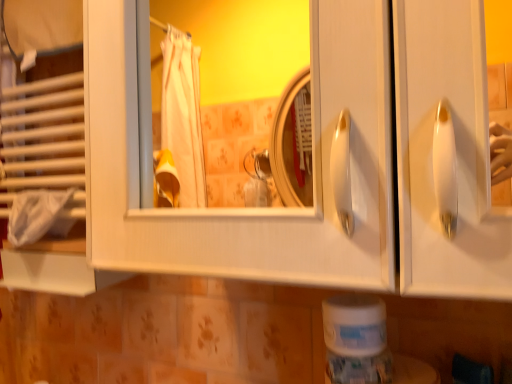
The image size is (512, 384). In order to click on white fabric bath towel at left in this screenshot , I will do `click(38, 216)`.

This screenshot has height=384, width=512. What do you see at coordinates (38, 216) in the screenshot?
I see `white fabric bath towel at left` at bounding box center [38, 216].

What do you see at coordinates (354, 325) in the screenshot?
I see `white matte toilet paper at lower center` at bounding box center [354, 325].

I want to click on white matte toilet paper at lower center, so click(x=354, y=325).

In order to face white matte toilet paper at lower center, should I rotate leftwards or rightwards?

It's best to rotate right around 12.979 degrees.

Locate an element on the screen. The image size is (512, 384). white fabric bath towel at left is located at coordinates (38, 216).

Does white matte toilet paper at lower center appear on the left side of white fabric bath towel at left?

Incorrect, white matte toilet paper at lower center is not on the left side of white fabric bath towel at left.

Is white matte toilet paper at lower center in front of or behind white fabric bath towel at left in the image?

A: Visually, white matte toilet paper at lower center is located in front of white fabric bath towel at left.

Is point (343, 313) behind point (29, 228)?

No.

From the image's perspective, between white matte toilet paper at lower center and white fabric bath towel at left, who is located below?

white matte toilet paper at lower center, from the image's perspective.

From a real-world perspective, is white matte toilet paper at lower center under white fabric bath towel at left?

Yes, from a real-world perspective, white matte toilet paper at lower center is under white fabric bath towel at left.

Does white matte toilet paper at lower center have a lesser width compared to white fabric bath towel at left?

No.

Does white matte toilet paper at lower center have a lesser height compared to white fabric bath towel at left?

Yes, white matte toilet paper at lower center is shorter than white fabric bath towel at left.

Between white matte toilet paper at lower center and white fabric bath towel at left, which one has larger size?

white fabric bath towel at left is bigger.

Would you say white matte toilet paper at lower center is inside or outside white fabric bath towel at left?

white matte toilet paper at lower center is not inside white fabric bath towel at left, it's outside.

Is there a large distance between white matte toilet paper at lower center and white fabric bath towel at left?

No, white matte toilet paper at lower center is not far from white fabric bath towel at left.

In the scene shown: Is white matte toilet paper at lower center turned away from white fabric bath towel at left?

white matte toilet paper at lower center is not turned away from white fabric bath towel at left.

What's the angular difference between white matte toilet paper at lower center and white fabric bath towel at left's facing directions?

The angular difference between white matte toilet paper at lower center and white fabric bath towel at left is 0.786 degrees.

Looking at this image, measure the distance from white matte toilet paper at lower center to white fabric bath towel at left.

The distance of white matte toilet paper at lower center from white fabric bath towel at left is 24.91 inches.

I want to click on bath towel lying above the white matte toilet paper at lower center (from the image's perspective), so coord(38,216).

Would you say white fabric bath towel at left is to the left or to the right of white matte toilet paper at lower center in the picture?

From the image, it's evident that white fabric bath towel at left is to the left of white matte toilet paper at lower center.

Is white fabric bath towel at left further to camera compared to white matte toilet paper at lower center?

Yes, it is.

Is point (44, 219) positioned after point (343, 343)?

Yes.

From the image's perspective, is white fabric bath towel at left under white matte toilet paper at lower center?

No.

From a real-world perspective, between white fabric bath towel at left and white matte toilet paper at lower center, who is vertically higher?

In real-world perspective, white fabric bath towel at left is above.

Considering the sizes of objects white fabric bath towel at left and white matte toilet paper at lower center in the image provided, who is thinner, white fabric bath towel at left or white matte toilet paper at lower center?

white fabric bath towel at left is thinner.

Which of these two, white fabric bath towel at left or white matte toilet paper at lower center, stands taller?

Standing taller between the two is white fabric bath towel at left.

Is white fabric bath towel at left smaller than white matte toilet paper at lower center?

Actually, white fabric bath towel at left might be larger than white matte toilet paper at lower center.

Would you say white fabric bath towel at left is inside or outside white matte toilet paper at lower center?

white fabric bath towel at left lies outside white matte toilet paper at lower center.

Is white fabric bath towel at left far from white matte toilet paper at lower center?

No.

Is white matte toilet paper at lower center at the back of white fabric bath towel at left?

white fabric bath towel at left does not have its back to white matte toilet paper at lower center.

What's the angular difference between white fabric bath towel at left and white matte toilet paper at lower center's facing directions?

They differ by 0.786 degrees in their facing directions.

I want to click on toilet paper located underneath the white fabric bath towel at left (from a real-world perspective), so click(354, 325).

Find the location of `toilet paper below the white fabric bath towel at left (from a real-world perspective)`. toilet paper below the white fabric bath towel at left (from a real-world perspective) is located at coordinates (354, 325).

The width and height of the screenshot is (512, 384). What are the coordinates of `bath towel that appears above the white matte toilet paper at lower center (from the image's perspective)` in the screenshot? It's located at (38, 216).